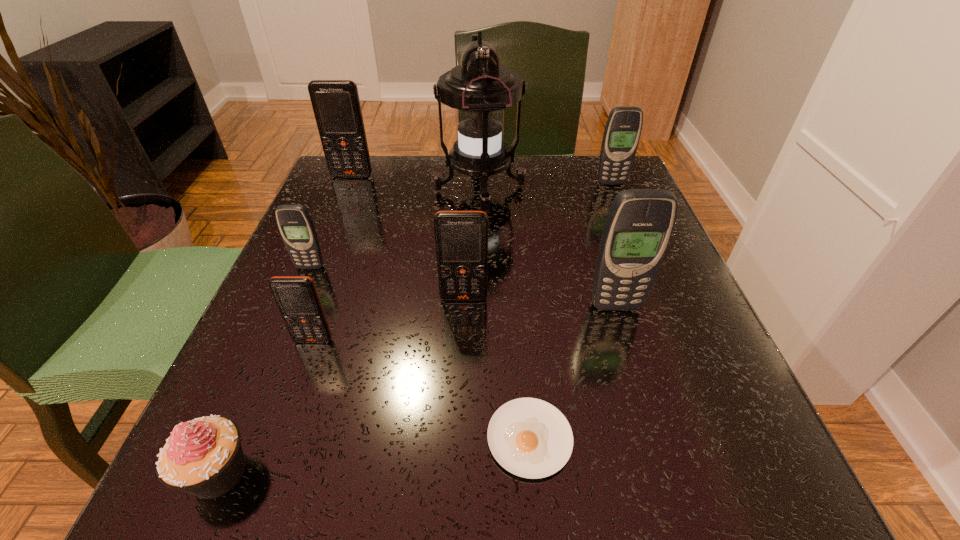
The image size is (960, 540). I want to click on cellular telephone that is the fourth closest one to the biggest orange cellular telephone, so click(x=623, y=128).

Find the location of a particular element. This screenshot has width=960, height=540. cellular telephone that stands as the fourth closest to the biggest orange cellular telephone is located at coordinates (623, 128).

Identify which orange cellular telephone is the closest to the nearest gray cellular telephone. Please provide its 2D coordinates. Your answer should be formatted as a tuple, i.e. [(x, y)], where the tuple contains the x and y coordinates of a point satisfying the conditions above.

[(461, 237)]

You are a GUI agent. You are given a task and a screenshot of the screen. Output one action in this format:
    pyautogui.click(x=<x>, y=<y>)
    Task: Click on the orange cellular telephone that stands as the closest to the second farthest orange cellular telephone
    The width and height of the screenshot is (960, 540).
    Given the screenshot: What is the action you would take?
    pyautogui.click(x=297, y=298)

Point out which gray cellular telephone is positioned as the nearest to the smallest gray cellular telephone. Please provide its 2D coordinates. Your answer should be formatted as a tuple, i.e. [(x, y)], where the tuple contains the x and y coordinates of a point satisfying the conditions above.

[(638, 228)]

This screenshot has height=540, width=960. Identify the location of the closest gray cellular telephone to the farthest gray cellular telephone. (638, 228).

Identify the location of free space that satisfies the following two spatial constraints: 1. on the screen of the smallest orange cellular telephone; 2. on the right side of the egg yolk. The width and height of the screenshot is (960, 540). (279, 438).

Find the location of a particular element. free spot that satisfies the following two spatial constraints: 1. on the screen of the lantern; 2. on the left side of the farthest orange cellular telephone is located at coordinates (347, 189).

Locate an element on the screen. The height and width of the screenshot is (540, 960). free point that satisfies the following two spatial constraints: 1. on the screen of the white egg yolk; 2. on the left side of the nearest cellular telephone is located at coordinates (279, 438).

What are the coordinates of `free location that satisfies the following two spatial constraints: 1. on the screen of the farthest orange cellular telephone; 2. on the right side of the lantern` in the screenshot? It's located at (347, 189).